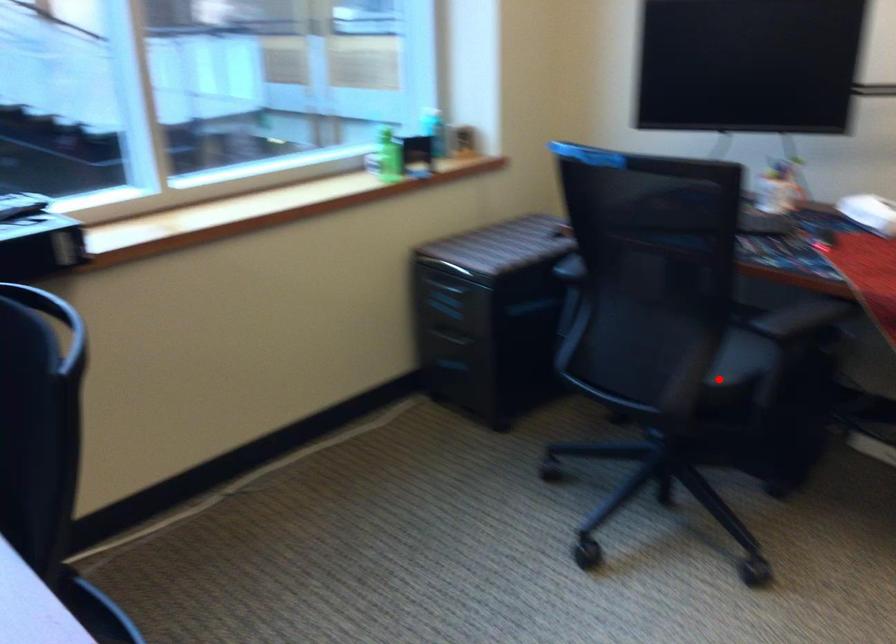
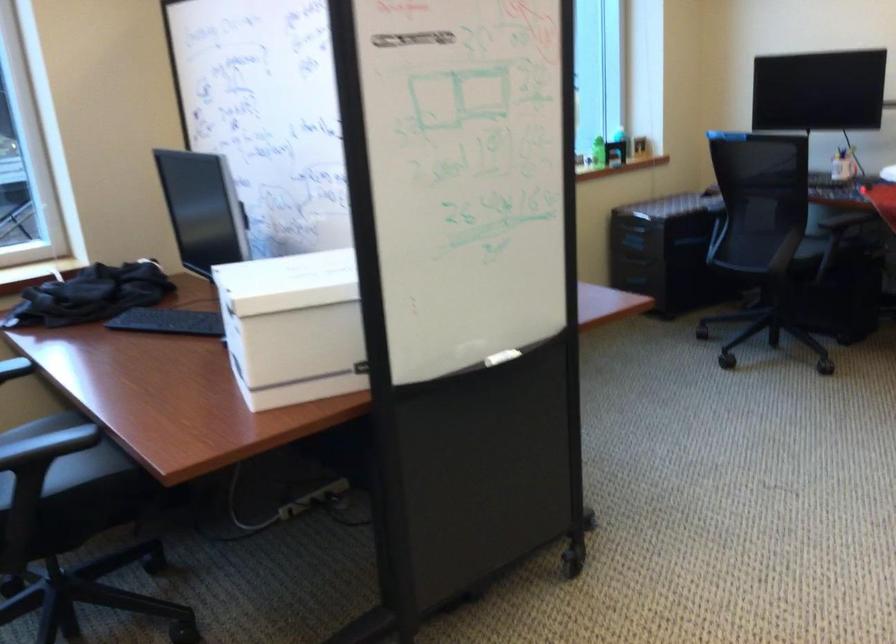
Where in the second image is the point corresponding to the highlighted location from the first image?

(811, 248)